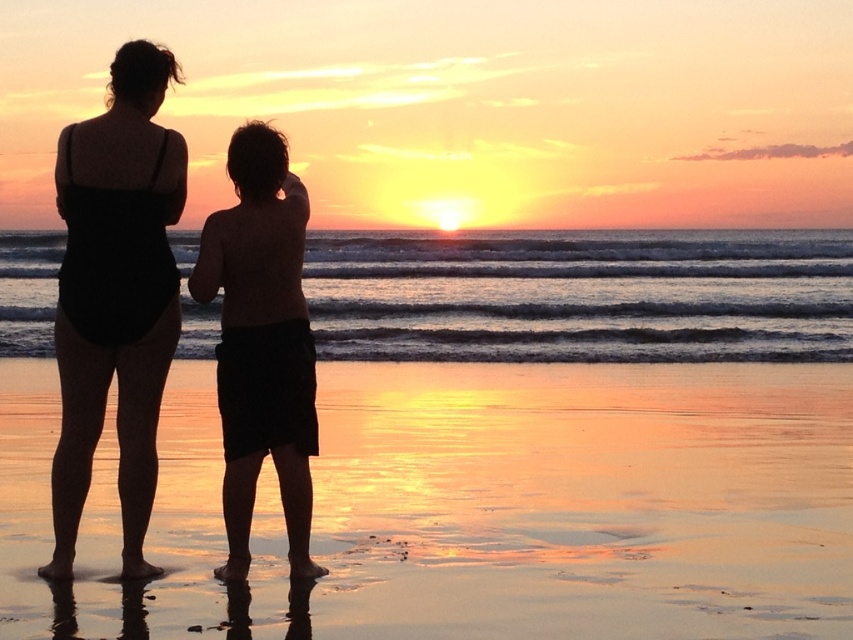
You are a photographer trying to capture the sunset scene. You notice the black matte swimsuit at left and the silhouette shorts at center. Which object should you focus on first if you want to photograph the one closer to the left side of the frame?

The black matte swimsuit at left is to the left of the silhouette shorts at center, so you should focus on the black matte swimsuit at left first as it is closer to the left side of the frame.

You are a photographer trying to capture the sunset scene. You have two subjects wearing the black matte swimsuit at left and silhouette shorts at center. Which subject should you focus on to ensure they appear larger in your photo?

The silhouette shorts at center should be focused on because it is larger than the black matte swimsuit at left, making it appear bigger in the photo.

You are a photographer trying to capture the sunset. You notice the shiny sand at lower center and the black matte swimsuit at left in your frame. Which object would you adjust your camera settings for to ensure proper exposure, considering their size in the scene?

The shiny sand at lower center has a larger size compared to the black matte swimsuit at left, so you should adjust your camera settings for the shiny sand at lower center to ensure proper exposure.